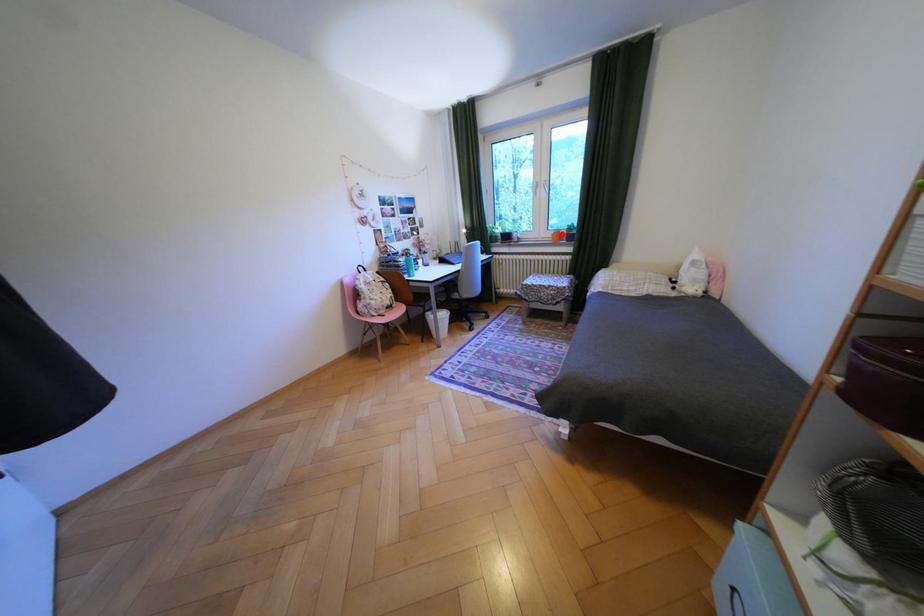
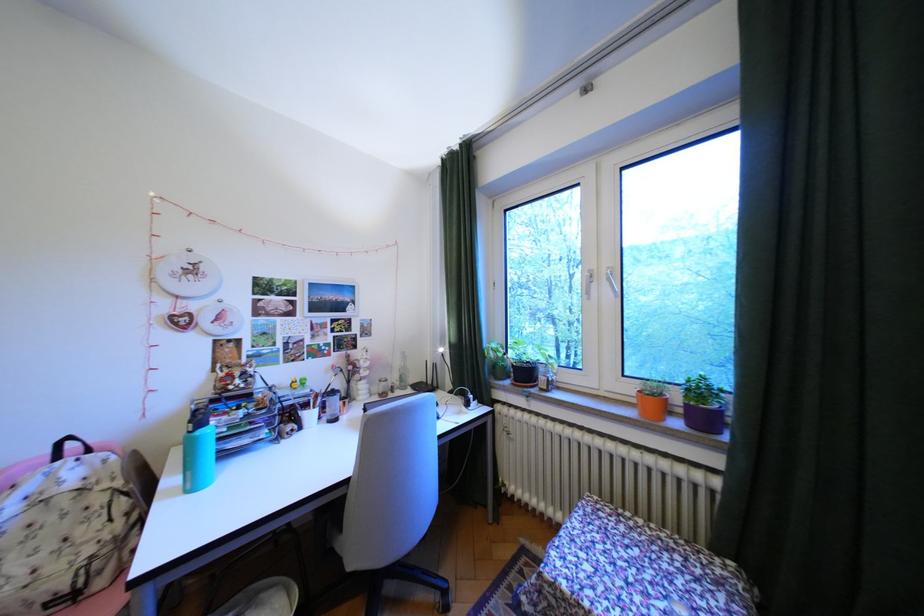
Locate, in the second image, the point that corresponds to the highlighted location in the first image.

(641, 390)